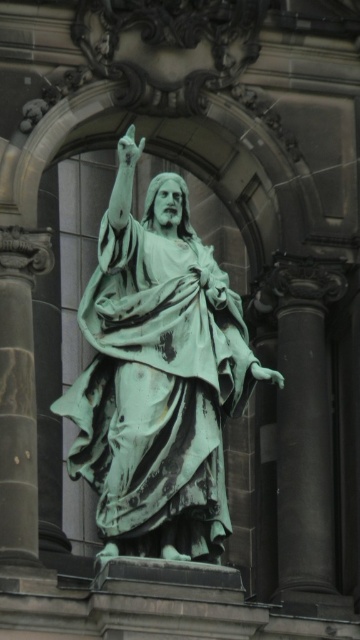
You are an art conservator assessing the space between the green patina statue at center and the green marble pillar at right. If the statue is 3 meters wide and the pillar is 2.5 meters wide, can you determine which object has a greater width?

The green patina statue at center is wider than the green marble pillar at right since it measures 3 meters compared to the pillar at 2.5 meters.

You are an art conservator assessing the space between the green patina statue at center and the green patina stone pillar at left. You need to place a protective barrier around the statue that is 1.2 meters wide. Is there enough space between the statue and the pillar to accommodate the barrier?

The green patina statue at center is wider than the green patina stone pillar at left. Therefore, there is sufficient space between them to place a 1.2 meter wide protective barrier around the statue.

You are standing at the base of the green marble pillar at right and want to take a photo of the statue of Jesus Christ with your camera. The statue is 12 feet tall. If the camera can capture objects up to 240 feet away, will you be able to take a clear photo of the statue?

The green marble pillar at right and camera are 241.38 feet apart. Since the camera can only capture up to 240 feet, you are 1.38 feet beyond the camera range. Therefore, you won cannot take a clear photo of the statue from that position.